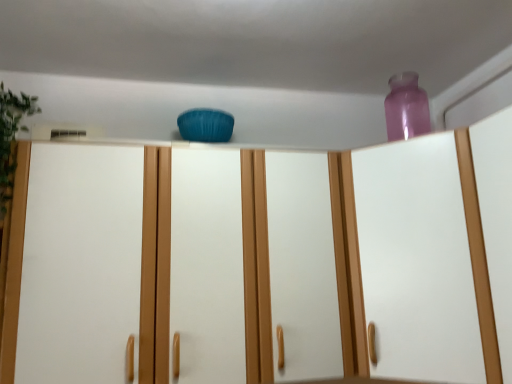
The height and width of the screenshot is (384, 512). Identify the location of transparent purple bottle at upper right. (406, 108).

The image size is (512, 384). I want to click on transparent plastic vase at upper right, so click(x=421, y=258).

Are matte blue cushion at center and transparent plastic vase at upper right beside each other?

matte blue cushion at center and transparent plastic vase at upper right are clearly separated.

In the image, is matte blue cushion at center on the left side or the right side of transparent plastic vase at upper right?

Based on their positions, matte blue cushion at center is located to the left of transparent plastic vase at upper right.

From a real-world perspective, between matte blue cushion at center and transparent plastic vase at upper right, who is vertically lower?

matte blue cushion at center, from a real-world perspective.

Between point (34, 147) and point (436, 159), which one is positioned in front?

The point (34, 147) is more forward.

Considering the relative sizes of transparent plastic vase at upper right and matte blue cushion at center in the image provided, is transparent plastic vase at upper right taller than matte blue cushion at center?

Yes.

Visually, is transparent plastic vase at upper right positioned to the left or to the right of matte blue cushion at center?

From the image, it's evident that transparent plastic vase at upper right is to the right of matte blue cushion at center.

From a real-world perspective, between transparent plastic vase at upper right and matte blue cushion at center, who is vertically higher?

In real-world perspective, transparent plastic vase at upper right is above.

Considering the sizes of objects matte blue cushion at center and transparent purple bottle at upper right in the image provided, who is smaller, matte blue cushion at center or transparent purple bottle at upper right?

With smaller size is transparent purple bottle at upper right.

Is matte blue cushion at center to the left of transparent purple bottle at upper right from the viewer's perspective?

Indeed, matte blue cushion at center is positioned on the left side of transparent purple bottle at upper right.

Considering the positions of points (303, 276) and (405, 122), is point (303, 276) closer to camera compared to point (405, 122)?

Yes.

From the picture: Which object is wider, matte blue cushion at center or transparent purple bottle at upper right?

With larger width is matte blue cushion at center.

Considering the sizes of objects green leafy plant at left and transparent plastic vase at upper right in the image provided, who is shorter, green leafy plant at left or transparent plastic vase at upper right?

green leafy plant at left is shorter.

Which of these two, green leafy plant at left or transparent plastic vase at upper right, is wider?

With larger width is transparent plastic vase at upper right.

From a real-world perspective, is green leafy plant at left positioned above or below transparent plastic vase at upper right?

green leafy plant at left is situated higher than transparent plastic vase at upper right in the real world.

Considering the relative positions of green leafy plant at left and transparent plastic vase at upper right in the image provided, is green leafy plant at left behind transparent plastic vase at upper right?

Yes.

From the image's perspective, is transparent plastic vase at upper right below transparent purple bottle at upper right?

Yes.

Could you measure the distance between transparent plastic vase at upper right and transparent purple bottle at upper right?

A distance of 26.99 inches exists between transparent plastic vase at upper right and transparent purple bottle at upper right.

Where is `glass door that is in front of the transparent purple bottle at upper right`? The height and width of the screenshot is (384, 512). glass door that is in front of the transparent purple bottle at upper right is located at coordinates (421, 258).

From the image's perspective, which object appears higher, green leafy plant at left or transparent purple bottle at upper right?

transparent purple bottle at upper right.

Identify the location of plant that is in front of the transparent purple bottle at upper right. Image resolution: width=512 pixels, height=384 pixels. (11, 137).

Is green leafy plant at left turned away from transparent purple bottle at upper right?

No, green leafy plant at left is not facing away from transparent purple bottle at upper right.

Does point (9, 188) come farther from viewer compared to point (426, 116)?

That is False.

Could you tell me if green leafy plant at left is facing matte blue cushion at center?

Yes, green leafy plant at left is facing matte blue cushion at center.

Is green leafy plant at left in front of matte blue cushion at center?

No, green leafy plant at left is further to the viewer.

Is point (1, 131) positioned behind point (468, 380)?

Yes, point (1, 131) is behind point (468, 380).

Is green leafy plant at left bigger than matte blue cushion at center?

No, green leafy plant at left is not bigger than matte blue cushion at center.

The width and height of the screenshot is (512, 384). I want to click on glass door above the matte blue cushion at center (from a real-world perspective), so click(421, 258).

What are the coordinates of `glass door above the matte blue cushion at center (from the image's perspective)` in the screenshot? It's located at (421, 258).

Considering their positions, is transparent plastic vase at upper right positioned closer to transparent purple bottle at upper right than green leafy plant at left?

transparent plastic vase at upper right lies closer to transparent purple bottle at upper right than the other object.

From the image, which object appears to be farther from green leafy plant at left, matte blue cushion at center or transparent purple bottle at upper right?

The object further to green leafy plant at left is transparent purple bottle at upper right.

Considering their positions, is transparent purple bottle at upper right positioned closer to green leafy plant at left than matte blue cushion at center?

matte blue cushion at center.

Estimate the real-world distances between objects in this image. Which object is further from green leafy plant at left, matte blue cushion at center or transparent plastic vase at upper right?

Among the two, transparent plastic vase at upper right is located further to green leafy plant at left.

In the scene shown: When comparing their distances from transparent purple bottle at upper right, does green leafy plant at left or matte blue cushion at center seem further?

green leafy plant at left.

Considering their positions, is green leafy plant at left positioned further to matte blue cushion at center than transparent plastic vase at upper right?

Based on the image, green leafy plant at left appears to be further to matte blue cushion at center.

When comparing their distances from transparent plastic vase at upper right, does green leafy plant at left or matte blue cushion at center seem further?

Among the two, green leafy plant at left is located further to transparent plastic vase at upper right.

From the image, which object appears to be farther from matte blue cushion at center, transparent plastic vase at upper right or green leafy plant at left?

green leafy plant at left is further to matte blue cushion at center.

Identify the location of bottle between matte blue cushion at center and transparent plastic vase at upper right from left to right. The height and width of the screenshot is (384, 512). (406, 108).

This screenshot has height=384, width=512. I want to click on cupboard between green leafy plant at left and transparent plastic vase at upper right, so click(x=262, y=260).

At what (x,y) coordinates should I click in order to perform the action: click on bottle between green leafy plant at left and transparent plastic vase at upper right. Please return your answer as a coordinate pair (x, y). Image resolution: width=512 pixels, height=384 pixels. Looking at the image, I should click on (406, 108).

Locate an element on the screen. This screenshot has height=384, width=512. cupboard between green leafy plant at left and transparent purple bottle at upper right is located at coordinates click(x=262, y=260).